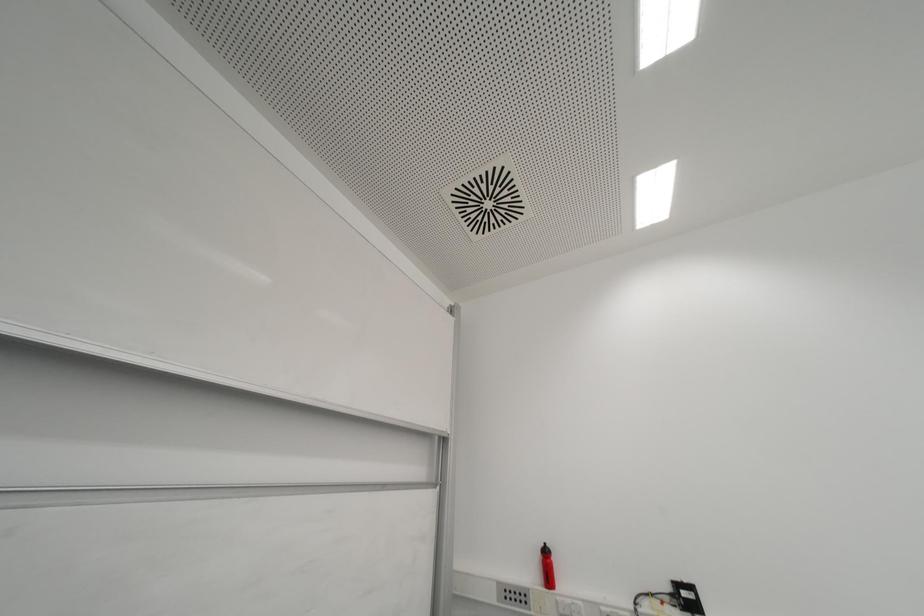
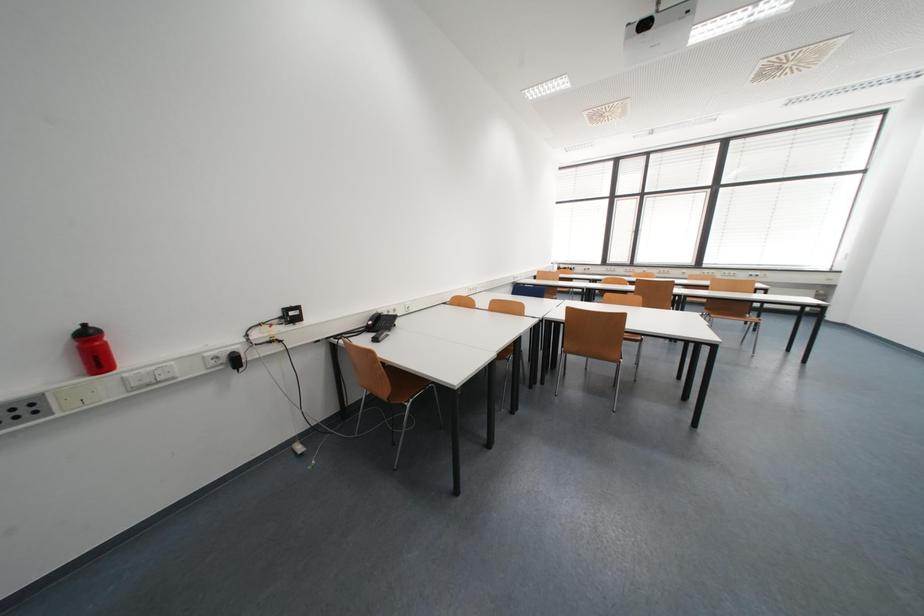
The first image is from the beginning of the video and the second image is from the end. How did the camera likely rotate when shooting the video?

The rotation direction of the camera is right-down.